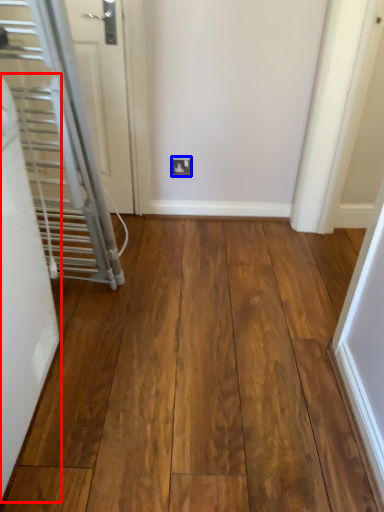
Question: Among these objects, which one is farthest to the camera, door (highlighted by a red box) or electric outlet (highlighted by a blue box)?

Choices:
 (A) door
 (B) electric outlet

Answer: (B)